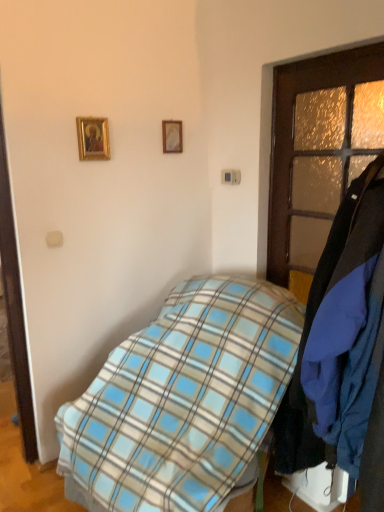
Question: Does blue plaid blanket at center touch gold-framed picture at upper center, placed as the 1th picture frame when sorted from right to left?

Choices:
 (A) no
 (B) yes

Answer: (A)

Question: Can you confirm if blue plaid blanket at center is wider than gold-framed picture at upper center, the 2th picture frame when ordered from front to back?

Choices:
 (A) no
 (B) yes

Answer: (B)

Question: Is blue plaid blanket at center smaller than gold-framed picture at upper center, placed as the 1th picture frame when sorted from right to left?

Choices:
 (A) yes
 (B) no

Answer: (B)

Question: Is blue plaid blanket at center turned away from gold-framed picture at upper center, the second picture frame when ordered from left to right?

Choices:
 (A) yes
 (B) no

Answer: (B)

Question: Is blue plaid blanket at center positioned beyond the bounds of gold-framed picture at upper center, placed as the 1th picture frame when sorted from right to left?

Choices:
 (A) yes
 (B) no

Answer: (A)

Question: In the image, is gold-framed picture at upper left, the first picture frame in the left-to-right sequence, positioned in front of or behind gold-framed picture at upper center, the 2th picture frame when ordered from front to back?

Choices:
 (A) front
 (B) behind

Answer: (A)

Question: Is point (84, 131) positioned closer to the camera than point (170, 150)?

Choices:
 (A) farther
 (B) closer

Answer: (B)

Question: Is gold-framed picture at upper left, the second picture frame positioned from the back, taller or shorter than gold-framed picture at upper center, the 2th picture frame when ordered from front to back?

Choices:
 (A) short
 (B) tall

Answer: (B)

Question: Considering the relative positions of gold-framed picture at upper left, the 1th picture frame from the front, and gold-framed picture at upper center, which is the first picture frame in back-to-front order, in the image provided, is gold-framed picture at upper left, the 1th picture frame from the front, to the left or to the right of gold-framed picture at upper center, which is the first picture frame in back-to-front order,?

Choices:
 (A) left
 (B) right

Answer: (A)

Question: From their relative heights in the image, would you say brown wooden door at right is taller or shorter than gold-framed picture at upper center, the second picture frame when ordered from left to right?

Choices:
 (A) short
 (B) tall

Answer: (B)

Question: From a real-world perspective, relative to gold-framed picture at upper center, placed as the 1th picture frame when sorted from right to left, is brown wooden door at right vertically above or below?

Choices:
 (A) above
 (B) below

Answer: (B)

Question: Looking at their shapes, would you say brown wooden door at right is wider or thinner than gold-framed picture at upper center, placed as the 1th picture frame when sorted from right to left?

Choices:
 (A) wide
 (B) thin

Answer: (A)

Question: Is brown wooden door at right situated inside gold-framed picture at upper center, the second picture frame when ordered from left to right, or outside?

Choices:
 (A) outside
 (B) inside

Answer: (A)

Question: From a real-world perspective, is gold-framed picture at upper center, placed as the 1th picture frame when sorted from right to left, above or below blue plaid blanket at center?

Choices:
 (A) above
 (B) below

Answer: (A)

Question: Does point (167, 130) appear closer or farther from the camera than point (64, 458)?

Choices:
 (A) closer
 (B) farther

Answer: (B)